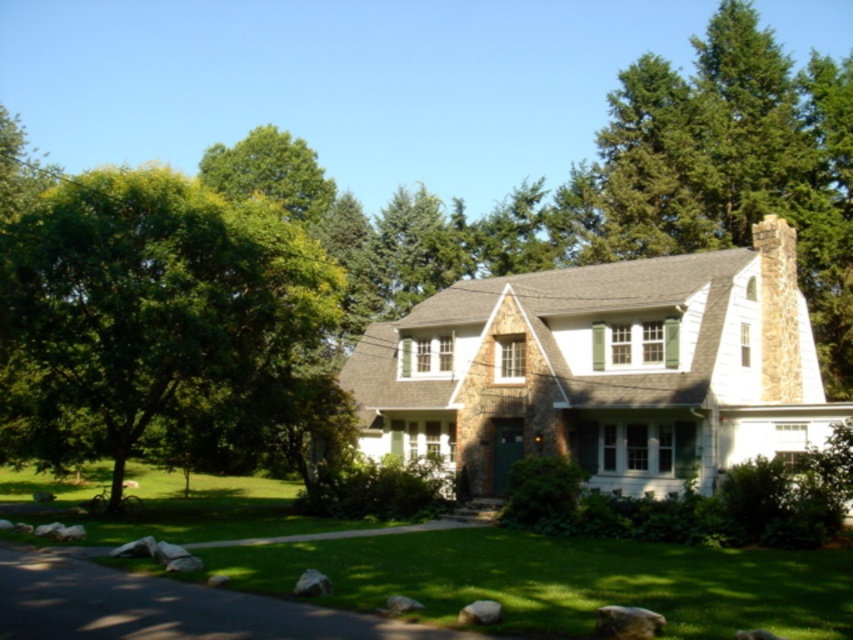
Question: Does green leafy tree at left appear on the left side of green grass at center?

Choices:
 (A) no
 (B) yes

Answer: (B)

Question: Does green leafy tree at left have a greater width compared to green grass at center?

Choices:
 (A) yes
 (B) no

Answer: (B)

Question: Which point is farther to the camera?

Choices:
 (A) green leafy tree at left
 (B) green grass at center

Answer: (A)

Question: Does green leafy tree at left appear on the right side of green grass at center?

Choices:
 (A) no
 (B) yes

Answer: (A)

Question: Which of the following is the closest to the observer?

Choices:
 (A) (788, 621)
 (B) (109, 500)

Answer: (A)

Question: Which object is farther from the camera taking this photo?

Choices:
 (A) green grass at center
 (B) green leafy tree at left

Answer: (B)